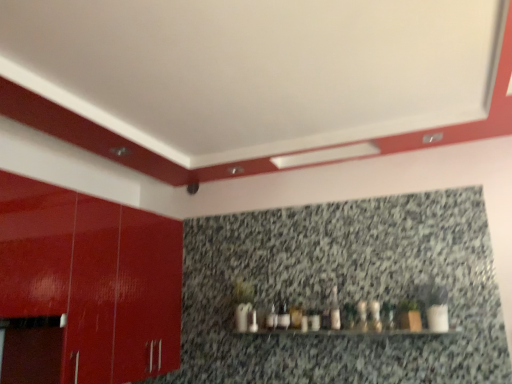
Question: Can you confirm if white glossy bottle at center, the third bottle when ordered from left to right, is thinner than glossy red cabinet at left?

Choices:
 (A) no
 (B) yes

Answer: (B)

Question: From a real-world perspective, is white glossy bottle at center, the third bottle when ordered from left to right, over glossy red cabinet at left?

Choices:
 (A) yes
 (B) no

Answer: (B)

Question: Considering the relative sizes of white glossy bottle at center, the third bottle when ordered from left to right, and glossy red cabinet at left in the image provided, is white glossy bottle at center, the third bottle when ordered from left to right, wider than glossy red cabinet at left?

Choices:
 (A) no
 (B) yes

Answer: (A)

Question: Is white glossy bottle at center, the third bottle when ordered from left to right, in contact with glossy red cabinet at left?

Choices:
 (A) yes
 (B) no

Answer: (B)

Question: Is white glossy bottle at center, which ranks as the 1th bottle in right-to-left order, to the left of glossy red cabinet at left from the viewer's perspective?

Choices:
 (A) yes
 (B) no

Answer: (B)

Question: Is white glossy bottle at center, the third bottle when ordered from left to right, not within glossy red cabinet at left?

Choices:
 (A) yes
 (B) no

Answer: (A)

Question: Does matte white bottle at center, the second bottle from the left, appear on the right side of glossy red cabinet at left?

Choices:
 (A) no
 (B) yes

Answer: (B)

Question: Is matte white bottle at center, the second bottle from the left, far away from glossy red cabinet at left?

Choices:
 (A) no
 (B) yes

Answer: (B)

Question: Is matte white bottle at center, the second bottle from the left, smaller than glossy red cabinet at left?

Choices:
 (A) no
 (B) yes

Answer: (B)

Question: Could you tell me if matte white bottle at center, the second bottle from the left, is facing glossy red cabinet at left?

Choices:
 (A) yes
 (B) no

Answer: (B)

Question: Is matte white bottle at center, the second bottle from the left, in front of glossy red cabinet at left?

Choices:
 (A) yes
 (B) no

Answer: (B)

Question: From the image's perspective, is matte white bottle at center, placed as the second bottle when sorted from right to left, under glossy red cabinet at left?

Choices:
 (A) yes
 (B) no

Answer: (A)

Question: Is white glossy bottle at center, the 3th bottle viewed from the right, wider than glossy red cabinet at left?

Choices:
 (A) yes
 (B) no

Answer: (B)